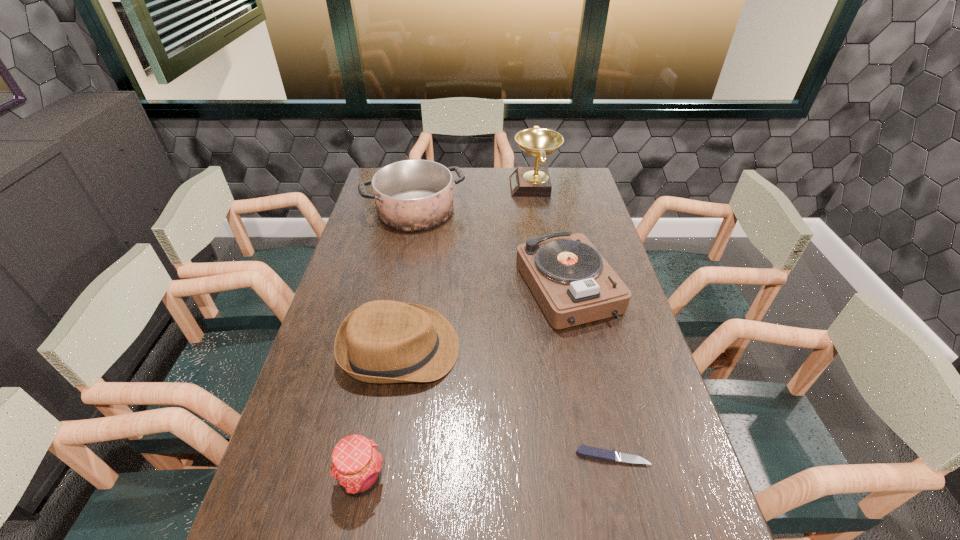
Locate an element on the screen. Image resolution: width=960 pixels, height=540 pixels. unoccupied position between the award and the saucepan is located at coordinates (475, 199).

You are a GUI agent. You are given a task and a screenshot of the screen. Output one action in this format:
    pyautogui.click(x=<x>, y=<y>)
    Task: Click on the free spot between the fedora and the jam
    
    Given the screenshot: What is the action you would take?
    pyautogui.click(x=380, y=413)

This screenshot has width=960, height=540. Identify the location of object that can be found as the closest to the jam. (383, 341).

Where is `object that ranks as the third closest to the fedora`? The image size is (960, 540). object that ranks as the third closest to the fedora is located at coordinates (595, 453).

Locate an element on the screen. The height and width of the screenshot is (540, 960). vacant region that satisfies the following two spatial constraints: 1. on the front-facing side of the record player; 2. on the left side of the award is located at coordinates (551, 287).

This screenshot has height=540, width=960. What are the coordinates of `vacant space that satisfies the following two spatial constraints: 1. on the back side of the steak knife; 2. on the front-facing side of the tallest object` in the screenshot? It's located at (550, 187).

Find the location of `free region that satisfies the following two spatial constraints: 1. on the front-facing side of the steak knife; 2. on the right side of the fedora`. free region that satisfies the following two spatial constraints: 1. on the front-facing side of the steak knife; 2. on the right side of the fedora is located at coordinates (382, 456).

You are a GUI agent. You are given a task and a screenshot of the screen. Output one action in this format:
    pyautogui.click(x=<x>, y=<y>)
    Task: Click on the free space in the image that satisfies the following two spatial constraints: 1. on the front-facing side of the award; 2. on the left side of the steak knife
    This screenshot has width=960, height=540.
    Given the screenshot: What is the action you would take?
    pyautogui.click(x=581, y=456)

You are a GUI agent. You are given a task and a screenshot of the screen. Output one action in this format:
    pyautogui.click(x=<x>, y=<y>)
    Task: Click on the free space that satisfies the following two spatial constraints: 1. on the back side of the jam; 2. on the right side of the second tallest object
    
    Given the screenshot: What is the action you would take?
    pyautogui.click(x=414, y=211)

Image resolution: width=960 pixels, height=540 pixels. I want to click on free space that satisfies the following two spatial constraints: 1. on the front-facing side of the fedora; 2. on the right side of the shortest object, so click(382, 456).